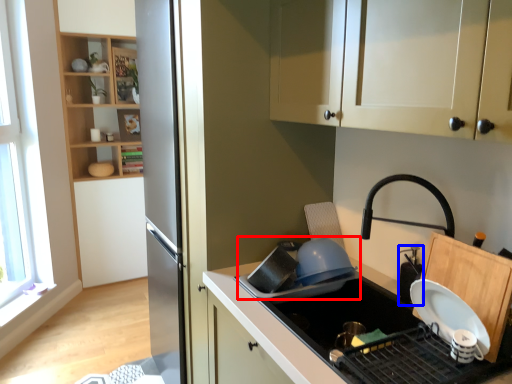
Question: Among these objects, which one is nearest to the camera, appliance (highlighted by a red box) or appliance (highlighted by a blue box)?

Choices:
 (A) appliance
 (B) appliance

Answer: (B)